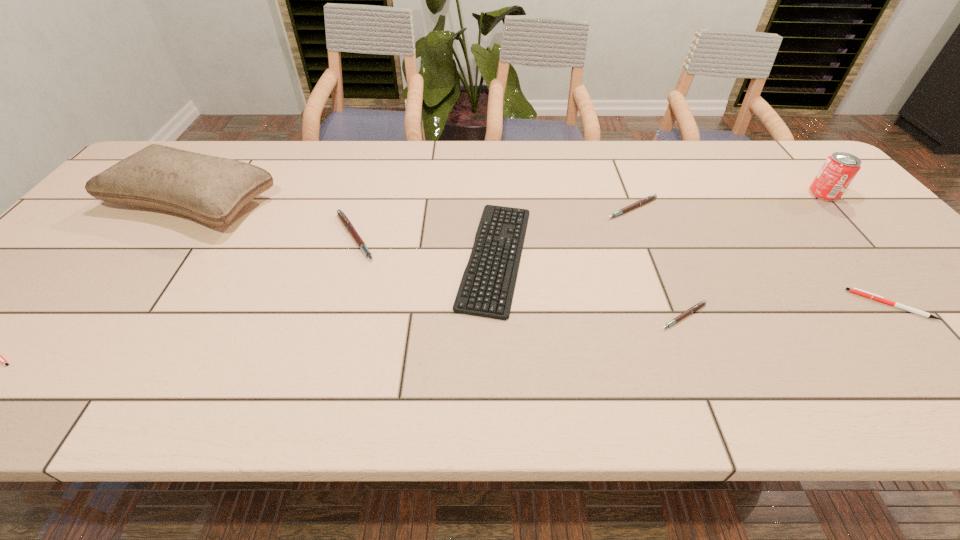
This screenshot has width=960, height=540. Find the location of `object that is at the far edge`. object that is at the far edge is located at coordinates (211, 189).

The image size is (960, 540). In order to click on object that is at the left edge in this screenshot , I will do `click(211, 189)`.

You are a GUI agent. You are given a task and a screenshot of the screen. Output one action in this format:
    pyautogui.click(x=<x>, y=<y>)
    Task: Click on the can present at the right edge
    
    Given the screenshot: What is the action you would take?
    pyautogui.click(x=839, y=169)

Find the location of `pen positioned at the right edge`. pen positioned at the right edge is located at coordinates (854, 290).

Find the location of `object situated at the far left corner`. object situated at the far left corner is located at coordinates pyautogui.click(x=211, y=189).

Locate an element on the screen. vacant space at the far edge of the desktop is located at coordinates (718, 167).

Identify the location of free location at the left edge. The image size is (960, 540). (94, 240).

The width and height of the screenshot is (960, 540). I want to click on vacant region at the right edge of the desktop, so click(x=839, y=238).

Identify the location of free region at the far right corner of the desktop. (776, 148).

Image resolution: width=960 pixels, height=540 pixels. In order to click on unoccupied area between the can and the fourth shortest pen in this screenshot , I will do `click(728, 201)`.